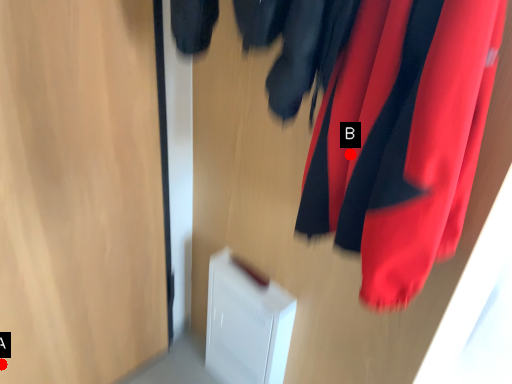
Question: Two points are circled on the image, labeled by A and B beside each circle. Which of the following is the closest to the observer?

Choices:
 (A) A is closer
 (B) B is closer

Answer: (B)